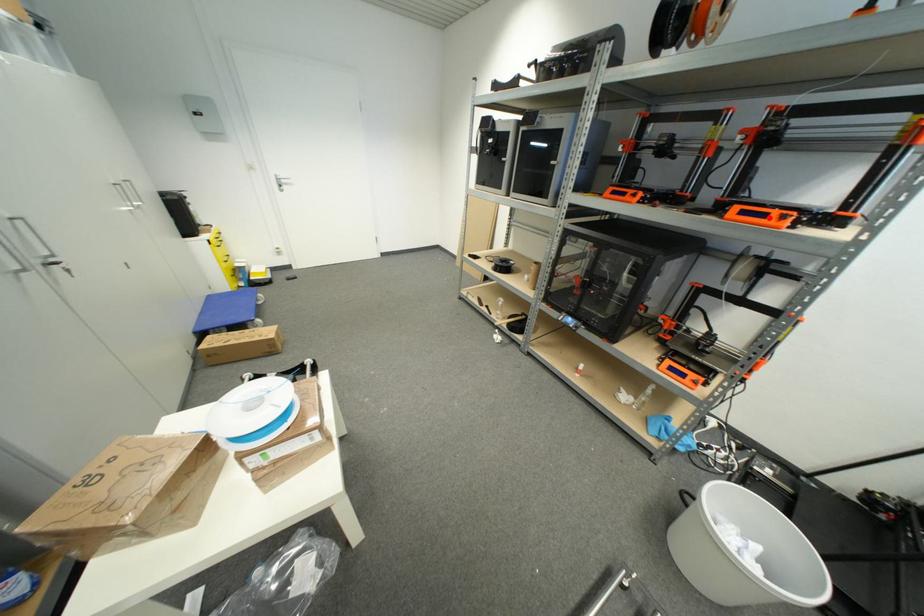
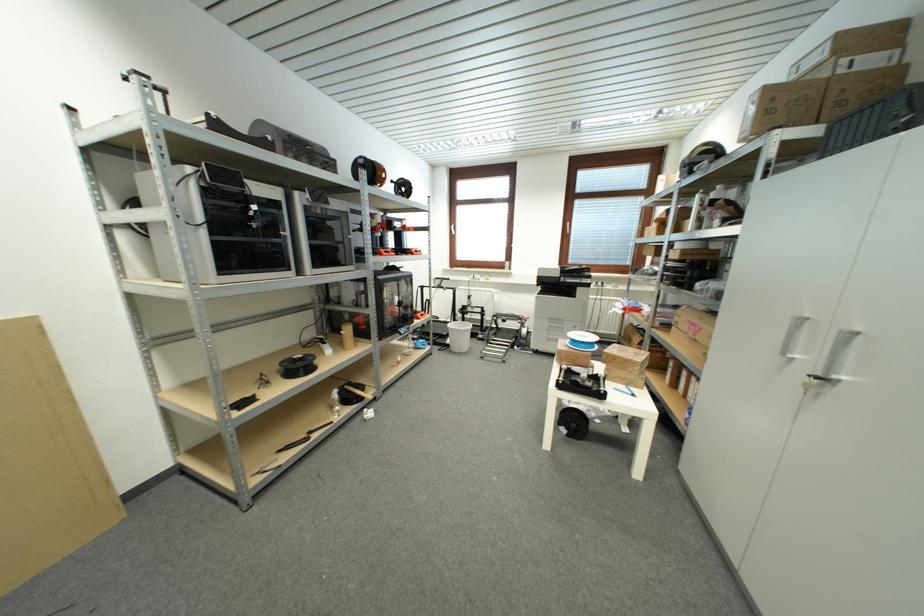
Question: I am providing you with two images of the same scene from different viewpoints. In image1, a red point is highlighted. Considering the same 3D point in image2, which of the following is correct?

Choices:
 (A) It is closer
 (B) It is farther

Answer: (A)